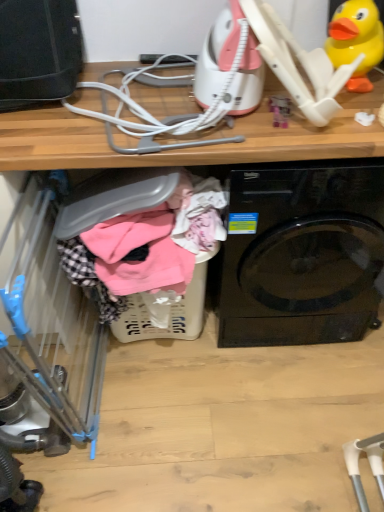
The width and height of the screenshot is (384, 512). I want to click on vacant space in front of plastic laundry basket at lower center, so click(x=177, y=411).